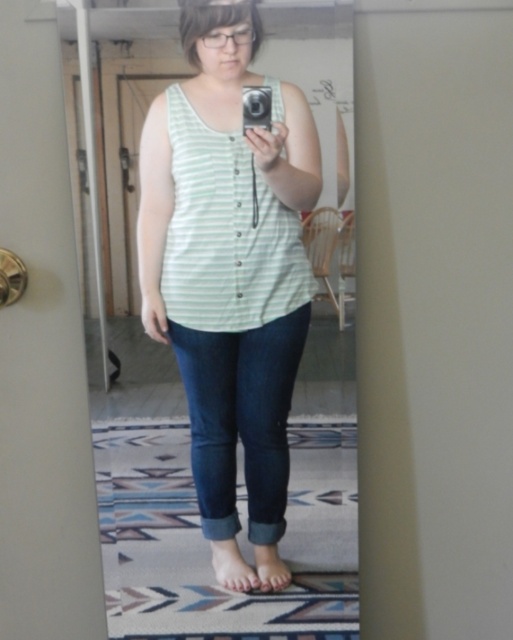
Question: Is light green striped tank top at center to the right of dark blue denim jeans at lower center from the viewer's perspective?

Choices:
 (A) no
 (B) yes

Answer: (A)

Question: Which object is positioned farthest from the dark blue denim jeans at lower center?

Choices:
 (A) green striped tank top at center
 (B) light green striped tank top at center

Answer: (A)

Question: Considering the real-world distances, which object is farthest from the green striped tank top at center?

Choices:
 (A) light green striped tank top at center
 (B) dark blue denim jeans at lower center

Answer: (B)

Question: Can you confirm if green striped tank top at center is positioned below dark blue denim jeans at lower center?

Choices:
 (A) yes
 (B) no

Answer: (B)

Question: Which point is closer to the camera?

Choices:
 (A) (202, 438)
 (B) (244, 136)

Answer: (B)

Question: Observing the image, what is the correct spatial positioning of light green striped tank top at center in reference to green striped tank top at center?

Choices:
 (A) below
 (B) above

Answer: (A)